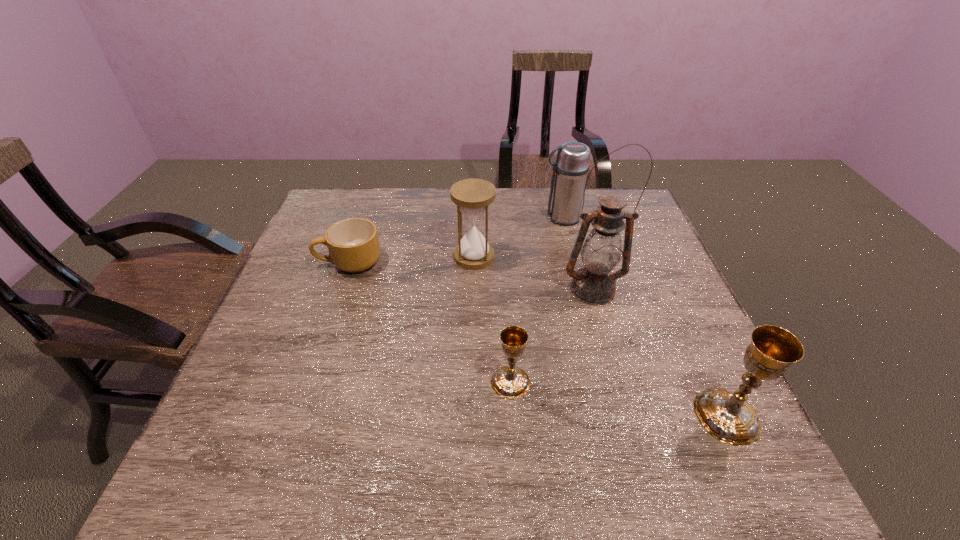
You are a GUI agent. You are given a task and a screenshot of the screen. Output one action in this format:
    pyautogui.click(x=<x>, y=<y>)
    Task: Click on the object that is at the near right corner
    This screenshot has height=540, width=960.
    Given the screenshot: What is the action you would take?
    pyautogui.click(x=726, y=415)

The width and height of the screenshot is (960, 540). Find the location of `free location at the far edge`. free location at the far edge is located at coordinates (535, 195).

Identify the location of vacant space at the near edge of the desktop. This screenshot has width=960, height=540. (522, 409).

Identify the location of free spot at the left edge of the desktop. The width and height of the screenshot is (960, 540). (308, 271).

Identify the location of vacant space at the right edge of the desktop. This screenshot has width=960, height=540. pos(636,288).

In order to click on vacant space at the far left corner of the desktop in this screenshot , I will do `click(346, 200)`.

In the image, there is a desktop. What are the coordinates of `free space at the near left corner` in the screenshot? It's located at (297, 398).

You are a GUI agent. You are given a task and a screenshot of the screen. Output one action in this format:
    pyautogui.click(x=<x>, y=<y>)
    Task: Click on the vacant space at the far right corner of the desktop
    This screenshot has height=540, width=960.
    Given the screenshot: What is the action you would take?
    pyautogui.click(x=639, y=222)

Where is `vacant space that is in between the shortest object and the thermos bottle`? The image size is (960, 540). vacant space that is in between the shortest object and the thermos bottle is located at coordinates (455, 240).

I want to click on free space between the oil lamp and the hourglass, so point(534,273).